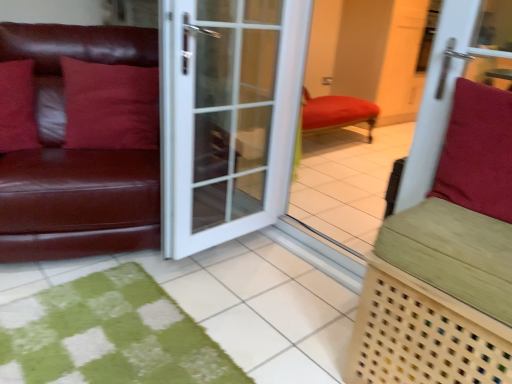
Find the location of a particular element. Image resolution: width=512 pixels, height=384 pixels. matte red pillow at left, marked as the third pillow in a front-to-back arrangement is located at coordinates (110, 106).

The image size is (512, 384). What do you see at coordinates (446, 263) in the screenshot? I see `green woven bench at right` at bounding box center [446, 263].

What is the approximate width of green woven bench at right?

green woven bench at right is 49.89 centimeters wide.

Image resolution: width=512 pixels, height=384 pixels. What do you see at coordinates (77, 202) in the screenshot?
I see `matte leather couch at left` at bounding box center [77, 202].

Locate an element on the screen. Image resolution: width=512 pixels, height=384 pixels. white glass door at center is located at coordinates (227, 116).

Identify the location of matte leather pillow at left, which appears as the second pillow when viewed from the front. This screenshot has width=512, height=384. (17, 107).

How much space does suede-like red cushion at right, arranged as the 1th pillow when viewed from the right, occupy vertically?

It is 17.90 inches.

Where is `matte red pillow at left, the 2th pillow from the right`? matte red pillow at left, the 2th pillow from the right is located at coordinates (110, 106).

Considering the sizes of objects white glass door at center and matte leather couch at left in the image provided, who is shorter, white glass door at center or matte leather couch at left?

Standing shorter between the two is matte leather couch at left.

Are white glass door at center and matte leather couch at left making contact?

There is a gap between white glass door at center and matte leather couch at left.

From the image's perspective, is white glass door at center positioned above or below matte leather couch at left?

From the image's perspective, white glass door at center appears below matte leather couch at left.

Choose the correct answer: Is white glass door at center inside matte leather couch at left or outside it?

white glass door at center is not enclosed by matte leather couch at left.

Does matte leather couch at left have a greater width compared to matte red pillow at left, which appears as the 1th pillow when viewed from the back?

Correct, the width of matte leather couch at left exceeds that of matte red pillow at left, which appears as the 1th pillow when viewed from the back.

Considering the sizes of objects matte leather couch at left and matte red pillow at left, which appears as the 1th pillow when viewed from the back, in the image provided, who is smaller, matte leather couch at left or matte red pillow at left, which appears as the 1th pillow when viewed from the back,?

matte red pillow at left, which appears as the 1th pillow when viewed from the back.

In the scene shown: Can you tell me how much matte leather couch at left and matte red pillow at left, the 2th pillow from the right, differ in facing direction?

0.923 degrees separate the facing orientations of matte leather couch at left and matte red pillow at left, the 2th pillow from the right.

From the picture: Is matte leather couch at left inside or outside of matte red pillow at left, marked as the third pillow in a front-to-back arrangement?

matte leather couch at left is outside matte red pillow at left, marked as the third pillow in a front-to-back arrangement.

Is suede-like red cushion at right, arranged as the third pillow when viewed from the back, turned away from matte leather pillow at left, which appears as the second pillow when viewed from the front?

No, suede-like red cushion at right, arranged as the third pillow when viewed from the back, is not facing away from matte leather pillow at left, which appears as the second pillow when viewed from the front.

Is matte leather pillow at left, the first pillow when ordered from left to right, located within suede-like red cushion at right, which ranks as the first pillow in front-to-back order?

Definitely not — matte leather pillow at left, the first pillow when ordered from left to right, is not inside suede-like red cushion at right, which ranks as the first pillow in front-to-back order.

From the picture: Considering the sizes of objects suede-like red cushion at right, the third pillow in the left-to-right sequence, and matte leather pillow at left, which appears as the second pillow when viewed from the front, in the image provided, who is wider, suede-like red cushion at right, the third pillow in the left-to-right sequence, or matte leather pillow at left, which appears as the second pillow when viewed from the front,?

suede-like red cushion at right, the third pillow in the left-to-right sequence.

From a real-world perspective, is suede-like red cushion at right, which ranks as the first pillow in front-to-back order, above or below matte leather pillow at left, the 2th pillow when ordered from back to front?

Clearly, from a real-world perspective, suede-like red cushion at right, which ranks as the first pillow in front-to-back order, is above matte leather pillow at left, the 2th pillow when ordered from back to front.

Considering the relative positions of suede-like red cushion at right, the third pillow in the left-to-right sequence, and white glass door at center in the image provided, is suede-like red cushion at right, the third pillow in the left-to-right sequence, to the right of white glass door at center from the viewer's perspective?

Indeed, suede-like red cushion at right, the third pillow in the left-to-right sequence, is positioned on the right side of white glass door at center.

Is suede-like red cushion at right, which ranks as the first pillow in front-to-back order, taller than white glass door at center?

In fact, suede-like red cushion at right, which ranks as the first pillow in front-to-back order, may be shorter than white glass door at center.

In terms of width, does suede-like red cushion at right, which ranks as the first pillow in front-to-back order, look wider or thinner when compared to white glass door at center?

suede-like red cushion at right, which ranks as the first pillow in front-to-back order, is wider than white glass door at center.

Between green woven bench at right and suede-like red cushion at right, the third pillow in the left-to-right sequence, which one has less height?

suede-like red cushion at right, the third pillow in the left-to-right sequence.

Does green woven bench at right contain suede-like red cushion at right, arranged as the 1th pillow when viewed from the right?

No, suede-like red cushion at right, arranged as the 1th pillow when viewed from the right, is not a part of green woven bench at right.

Considering the sizes of objects green woven bench at right and suede-like red cushion at right, arranged as the third pillow when viewed from the back, in the image provided, who is smaller, green woven bench at right or suede-like red cushion at right, arranged as the third pillow when viewed from the back,?

With smaller size is suede-like red cushion at right, arranged as the third pillow when viewed from the back.

Considering the points (367, 354) and (446, 187), which point is behind, point (367, 354) or point (446, 187)?

Point (446, 187)

Is green woven bench at right oriented away from matte red pillow at left, which appears as the 1th pillow when viewed from the back?

No, green woven bench at right is not facing away from matte red pillow at left, which appears as the 1th pillow when viewed from the back.

Which of these two, green woven bench at right or matte red pillow at left, the 2th pillow from the right, stands taller?

green woven bench at right.

Based on the photo, how many degrees apart are the facing directions of green woven bench at right and matte red pillow at left, which appears as the 1th pillow when viewed from the back?

green woven bench at right and matte red pillow at left, which appears as the 1th pillow when viewed from the back, are facing 70.4 degrees away from each other.

Would you consider green woven bench at right to be distant from matte red pillow at left, which appears as the 1th pillow when viewed from the back?

Yes, green woven bench at right is far from matte red pillow at left, which appears as the 1th pillow when viewed from the back.

I want to click on furniture located underneath the white glass door at center (from a real-world perspective), so click(x=446, y=263).

Between point (370, 329) and point (257, 56), which one is positioned behind?

The point (257, 56) is farther.

From their relative heights in the image, would you say green woven bench at right is taller or shorter than white glass door at center?

Considering their sizes, green woven bench at right has less height than white glass door at center.

Would you say green woven bench at right contains white glass door at center?

No, white glass door at center is not surrounded by green woven bench at right.

The image size is (512, 384). In order to click on studio couch in front of the white glass door at center in this screenshot , I will do `click(77, 202)`.

The height and width of the screenshot is (384, 512). Identify the location of the 2nd pillow above the matte leather couch at left (from a real-world perspective). (110, 106).

From the image, which object appears to be farther from matte leather couch at left, green woven bench at right or white glass door at center?

The object further to matte leather couch at left is green woven bench at right.

Looking at the image, which one is located closer to matte red pillow at left, the 2th pillow from the right, white glass door at center or matte leather couch at left?

matte leather couch at left lies closer to matte red pillow at left, the 2th pillow from the right, than the other object.

Looking at the image, which one is located further to green woven bench at right, matte leather couch at left or suede-like red cushion at right, arranged as the third pillow when viewed from the back?

matte leather couch at left is positioned further to the anchor green woven bench at right.

Considering their positions, is green woven bench at right positioned closer to white glass door at center than matte leather couch at left?

The object closer to white glass door at center is matte leather couch at left.

From the image, which object appears to be farther from green woven bench at right, matte leather pillow at left, the 2th pillow when ordered from back to front, or white glass door at center?

matte leather pillow at left, the 2th pillow when ordered from back to front, is further to green woven bench at right.

From the image, which object appears to be farther from matte leather couch at left, matte red pillow at left, marked as the third pillow in a front-to-back arrangement, or suede-like red cushion at right, arranged as the 1th pillow when viewed from the right?

suede-like red cushion at right, arranged as the 1th pillow when viewed from the right, is further to matte leather couch at left.

When comparing their distances from suede-like red cushion at right, the third pillow in the left-to-right sequence, does white glass door at center or green woven bench at right seem further?

white glass door at center is further to suede-like red cushion at right, the third pillow in the left-to-right sequence.

Based on their spatial positions, is green woven bench at right or suede-like red cushion at right, arranged as the third pillow when viewed from the back, closer to white glass door at center?

Among the two, green woven bench at right is located nearer to white glass door at center.

Where is `door between matte red pillow at left, which appears as the 1th pillow when viewed from the back, and green woven bench at right`? door between matte red pillow at left, which appears as the 1th pillow when viewed from the back, and green woven bench at right is located at coordinates (227, 116).

This screenshot has height=384, width=512. In order to click on pillow located between matte leather couch at left and suede-like red cushion at right, arranged as the 1th pillow when viewed from the right, in the left-right direction in this screenshot , I will do `click(110, 106)`.

Find the location of a particular element. studio couch between matte leather pillow at left, the 2th pillow when ordered from back to front, and suede-like red cushion at right, which ranks as the first pillow in front-to-back order, from left to right is located at coordinates (77, 202).

The width and height of the screenshot is (512, 384). What are the coordinates of `studio couch located between matte leather pillow at left, which ranks as the third pillow in right-to-left order, and green woven bench at right in the left-right direction` in the screenshot? It's located at (77, 202).